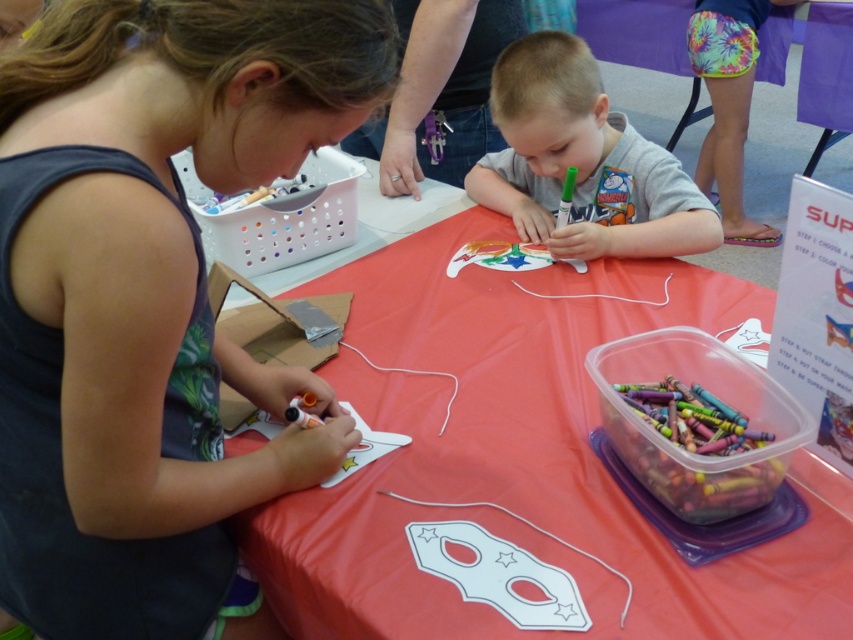
Which is above, matte white paper mask at center or gray matte shirt at center?

gray matte shirt at center is higher up.

Does matte white paper mask at center appear on the left side of gray matte shirt at center?

Correct, you'll find matte white paper mask at center to the left of gray matte shirt at center.

Between point (492, 355) and point (589, 244), which one is positioned in front?

Point (492, 355) is in front.

Identify the location of matte white paper mask at center. (518, 456).

Who is higher up, matte black tank top at upper left or gray matte shirt at center?

gray matte shirt at center is above.

The height and width of the screenshot is (640, 853). What do you see at coordinates (161, 259) in the screenshot?
I see `matte black tank top at upper left` at bounding box center [161, 259].

Is point (13, 132) farther from viewer compared to point (585, 237)?

No, it is not.

Locate an element on the screen. The image size is (853, 640). matte black tank top at upper left is located at coordinates (161, 259).

From the picture: Can you confirm if matte black tank top at upper left is positioned to the right of matte white paper mask at center?

No, matte black tank top at upper left is not to the right of matte white paper mask at center.

Is point (361, 44) positioned behind point (654, 630)?

No.

In order to click on matte black tank top at upper left in this screenshot , I will do `click(161, 259)`.